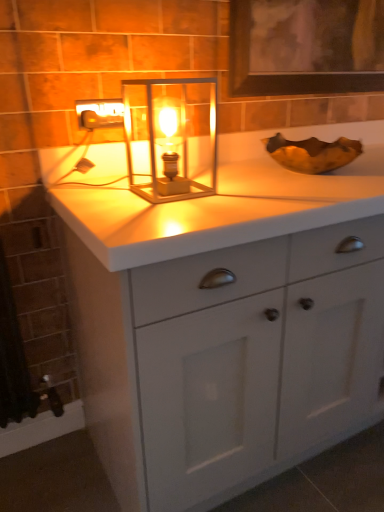
You are a GUI agent. You are given a task and a screenshot of the screen. Output one action in this format:
    pyautogui.click(x=<x>, y=<y>)
    Task: Click on the matte silver outlet at upper left
    
    Given the screenshot: What is the action you would take?
    pyautogui.click(x=100, y=113)

What do you see at coordinates (100, 113) in the screenshot? I see `matte silver outlet at upper left` at bounding box center [100, 113].

Find the location of a particular element. The height and width of the screenshot is (512, 384). translucent glass lantern at center is located at coordinates (171, 138).

Find the location of a particular element. white matte cabinet at center is located at coordinates (x=228, y=320).

Between translucent glass lantern at center and white matte cabinet at center, which one appears on the left side from the viewer's perspective?

translucent glass lantern at center is more to the left.

From the image's perspective, is translucent glass lantern at center located beneath white matte cabinet at center?

Actually, translucent glass lantern at center appears above white matte cabinet at center in the image.

What's the angular difference between translucent glass lantern at center and white matte cabinet at center's facing directions?

The angle between the facing direction of translucent glass lantern at center and the facing direction of white matte cabinet at center is 0.000748 degrees.

Does translucent glass lantern at center come in front of white matte cabinet at center?

No, it is not.

Is matte silver outlet at upper left in contact with translucent glass lantern at center?

No, matte silver outlet at upper left is not beside translucent glass lantern at center.

Can you confirm if matte silver outlet at upper left is smaller than translucent glass lantern at center?

Yes, matte silver outlet at upper left is smaller than translucent glass lantern at center.

How much distance is there between matte silver outlet at upper left and translucent glass lantern at center?

matte silver outlet at upper left and translucent glass lantern at center are 21.54 centimeters apart.

Which of these two, matte silver outlet at upper left or translucent glass lantern at center, is wider?

translucent glass lantern at center is wider.

Who is bigger, white matte cabinet at center or matte silver outlet at upper left?

Bigger between the two is white matte cabinet at center.

From the image's perspective, is white matte cabinet at center beneath matte silver outlet at upper left?

Yes, from the image's perspective, white matte cabinet at center is beneath matte silver outlet at upper left.

Could you tell me if white matte cabinet at center is turned towards matte silver outlet at upper left?

No, white matte cabinet at center is not facing towards matte silver outlet at upper left.

From a real-world perspective, is white matte cabinet at center physically below matte silver outlet at upper left?

Indeed, from a real-world perspective, white matte cabinet at center is positioned beneath matte silver outlet at upper left.

In the scene shown: What's the angular difference between matte silver outlet at upper left and white matte cabinet at center's facing directions?

0.00579 degrees separate the facing orientations of matte silver outlet at upper left and white matte cabinet at center.

Can you confirm if matte silver outlet at upper left is shorter than white matte cabinet at center?

Yes, matte silver outlet at upper left is shorter than white matte cabinet at center.

Is matte silver outlet at upper left facing towards white matte cabinet at center?

No, matte silver outlet at upper left does not turn towards white matte cabinet at center.

Based on their sizes in the image, would you say matte silver outlet at upper left is bigger or smaller than white matte cabinet at center?

Considering their sizes, matte silver outlet at upper left takes up less space than white matte cabinet at center.

Is white matte cabinet at center wider or thinner than translucent glass lantern at center?

Clearly, white matte cabinet at center has more width compared to translucent glass lantern at center.

Is white matte cabinet at center next to translucent glass lantern at center and touching it?

They are not placed beside each other.

In the scene shown: From the image's perspective, is white matte cabinet at center on top of translucent glass lantern at center?

No.

From a real-world perspective, is white matte cabinet at center located higher than translucent glass lantern at center?

No, from a real-world perspective, white matte cabinet at center is not above translucent glass lantern at center.

Is translucent glass lantern at center taller than matte silver outlet at upper left?

Indeed, translucent glass lantern at center has a greater height compared to matte silver outlet at upper left.

Is translucent glass lantern at center smaller than matte silver outlet at upper left?

No.

Which is in front, point (166, 114) or point (102, 102)?

The point (166, 114) is closer to the camera.

Considering the sizes of objects translucent glass lantern at center and matte silver outlet at upper left in the image provided, who is wider, translucent glass lantern at center or matte silver outlet at upper left?

With larger width is translucent glass lantern at center.

Find the location of `bathroom cabinet lying below the translucent glass lantern at center (from the image's perspective)`. bathroom cabinet lying below the translucent glass lantern at center (from the image's perspective) is located at coordinates (228, 320).

Where is `candle holder in front of the matte silver outlet at upper left`? candle holder in front of the matte silver outlet at upper left is located at coordinates (171, 138).

Looking at the image, which one is located closer to translucent glass lantern at center, matte silver outlet at upper left or white matte cabinet at center?

matte silver outlet at upper left is closer to translucent glass lantern at center.

From the picture: Which object lies further to the anchor point white matte cabinet at center, translucent glass lantern at center or matte silver outlet at upper left?

The object further to white matte cabinet at center is matte silver outlet at upper left.

From the image, which object appears to be nearer to white matte cabinet at center, matte silver outlet at upper left or translucent glass lantern at center?

translucent glass lantern at center is closer to white matte cabinet at center.

Which object lies further to the anchor point matte silver outlet at upper left, translucent glass lantern at center or white matte cabinet at center?

The object further to matte silver outlet at upper left is white matte cabinet at center.

From the image, which object appears to be farther from matte silver outlet at upper left, white matte cabinet at center or translucent glass lantern at center?

white matte cabinet at center lies further to matte silver outlet at upper left than the other object.

When comparing their distances from translucent glass lantern at center, does white matte cabinet at center or matte silver outlet at upper left seem further?

The object further to translucent glass lantern at center is white matte cabinet at center.

Locate an element on the screen. The image size is (384, 512). candle holder between matte silver outlet at upper left and white matte cabinet at center in the vertical direction is located at coordinates (171, 138).